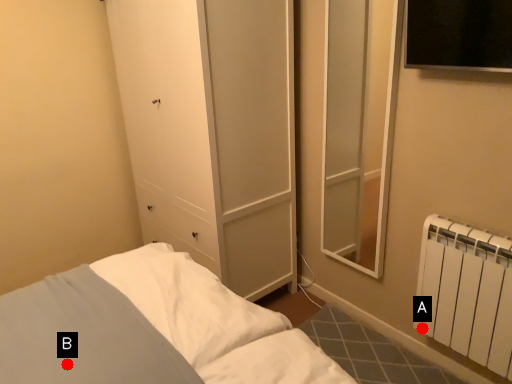
Question: Two points are circled on the image, labeled by A and B beside each circle. Which point is closer to the camera?

Choices:
 (A) A is closer
 (B) B is closer

Answer: (B)